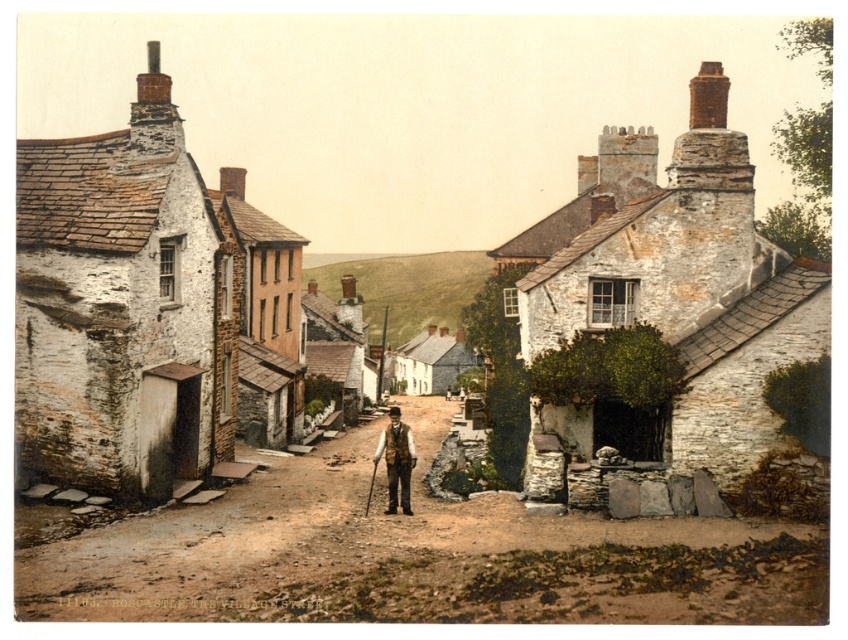
Looking at this image, between brown stone alley at center and stone houses at center, which one is positioned higher?

Positioned higher is stone houses at center.

Between brown stone alley at center and stone houses at center, which one appears on the left side from the viewer's perspective?

From the viewer's perspective, stone houses at center appears more on the left side.

This screenshot has width=848, height=640. Describe the element at coordinates (417, 560) in the screenshot. I see `brown stone alley at center` at that location.

Locate an element on the screen. The image size is (848, 640). brown stone alley at center is located at coordinates (417, 560).

Does stone houses at center have a smaller size compared to brown leather vest at center?

Actually, stone houses at center might be larger than brown leather vest at center.

Does point (717, 333) come behind point (406, 474)?

Yes, point (717, 333) is farther from viewer.

Image resolution: width=848 pixels, height=640 pixels. In order to click on stone houses at center in this screenshot , I will do `click(678, 280)`.

I want to click on stone houses at center, so click(678, 280).

Is brown stone alley at center to the left of brown leather vest at center from the viewer's perspective?

No, brown stone alley at center is not to the left of brown leather vest at center.

Does brown stone alley at center have a lesser height compared to brown leather vest at center?

Yes.

The image size is (848, 640). Describe the element at coordinates (417, 560) in the screenshot. I see `brown stone alley at center` at that location.

At what (x,y) coordinates should I click in order to perform the action: click on brown stone alley at center. Please return your answer as a coordinate pair (x, y). This screenshot has height=640, width=848. Looking at the image, I should click on (417, 560).